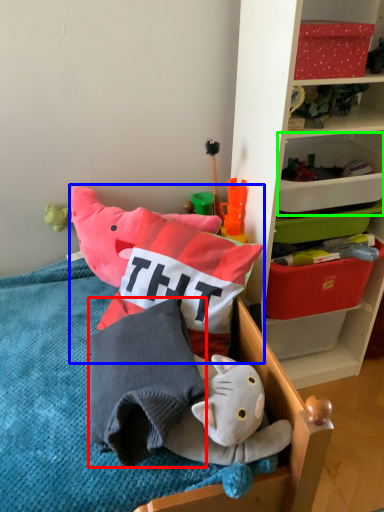
Question: Which is farther away from pillow (highlighted by a red box)? toy (highlighted by a blue box) or storage box (highlighted by a green box)?

Choices:
 (A) toy
 (B) storage box

Answer: (B)